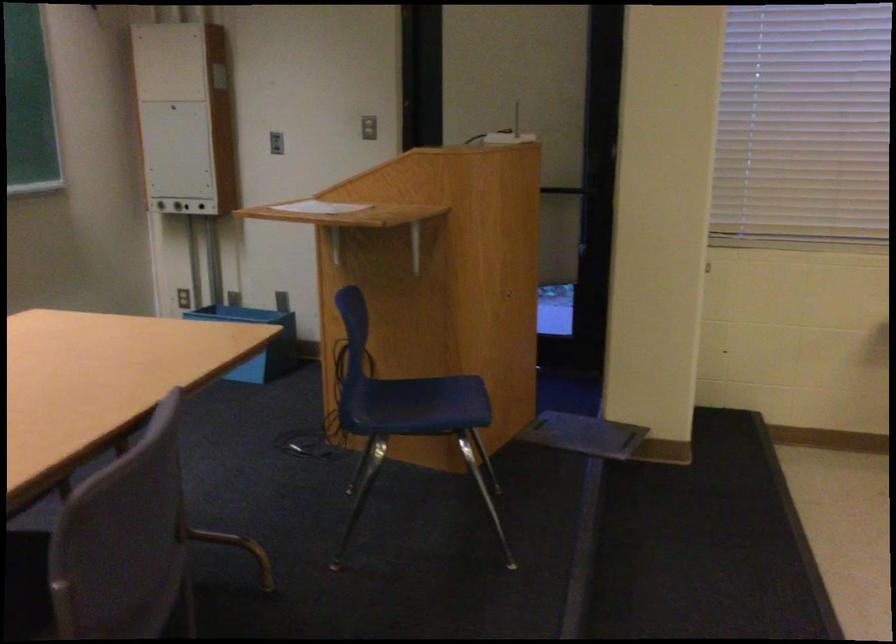
What are the coordinates of `blue chair sitting surface` in the screenshot? It's located at point(424,398).